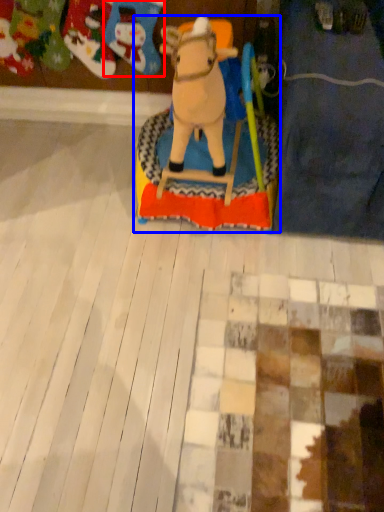
Question: Which point is closer to the camera, toy (highlighted by a red box) or toy (highlighted by a blue box)?

Choices:
 (A) toy
 (B) toy

Answer: (B)